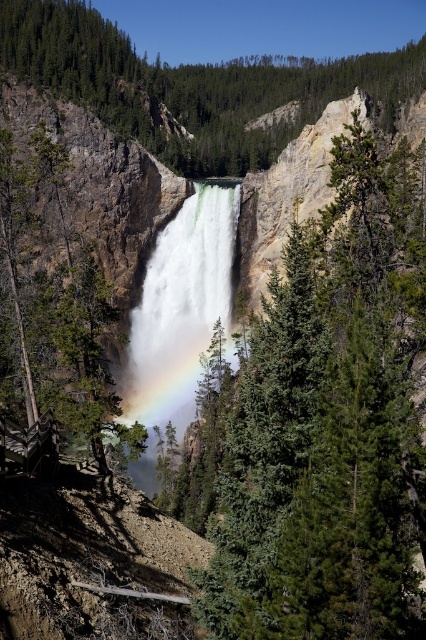
Question: Is green leafy tree at center above green matte tree at left?

Choices:
 (A) yes
 (B) no

Answer: (A)

Question: Does green matte tree at center appear on the left side of green leafy tree at center?

Choices:
 (A) yes
 (B) no

Answer: (A)

Question: Which object is farther from the camera taking this photo?

Choices:
 (A) green leafy tree at center
 (B) white frothy water at center
 (C) green matte tree at center

Answer: (A)

Question: Which object is farther from the camera taking this photo?

Choices:
 (A) white frothy water at center
 (B) green leafy tree at center
 (C) green matte tree at left

Answer: (B)

Question: Based on their relative distances, which object is farther from the white frothy water at center?

Choices:
 (A) green matte tree at center
 (B) green leafy tree at center

Answer: (B)

Question: Is green matte tree at center further to the viewer compared to green leafy tree at center?

Choices:
 (A) yes
 (B) no

Answer: (B)